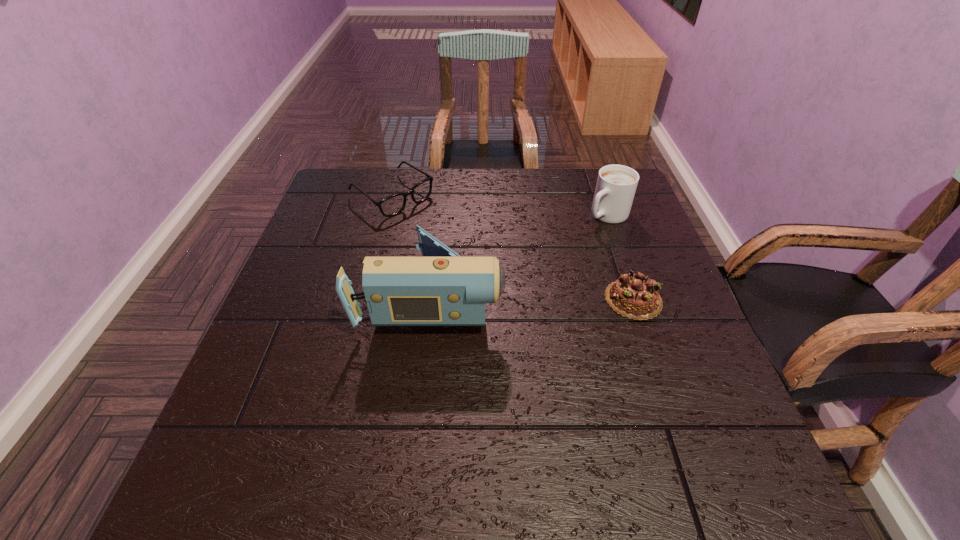
At what (x,y) coordinates should I click in order to perform the action: click on free spot between the cappuccino and the chocolate cake. Please return your answer as a coordinate pair (x, y). This screenshot has width=960, height=540. Looking at the image, I should click on (620, 257).

You are a GUI agent. You are given a task and a screenshot of the screen. Output one action in this format:
    pyautogui.click(x=<x>, y=<y>)
    Task: Click on the free space between the chocolate cake and the camcorder
    This screenshot has width=960, height=540.
    Given the screenshot: What is the action you would take?
    pyautogui.click(x=533, y=298)

Identify the location of vacant space that's between the spectacles and the cappuccino. The image size is (960, 540). (499, 205).

This screenshot has height=540, width=960. In order to click on free spot between the chocolate cake and the tallest object in this screenshot , I will do `click(533, 298)`.

Identify the location of vacant area that lies between the chocolate cake and the tallest object. Image resolution: width=960 pixels, height=540 pixels. (533, 298).

Locate an element on the screen. The image size is (960, 540). the second closest object to the second tallest object is located at coordinates (441, 288).

You are a GUI agent. You are given a task and a screenshot of the screen. Output one action in this format:
    pyautogui.click(x=<x>, y=<y>)
    Task: Click on the object that is the third closest one to the spectacles
    
    Given the screenshot: What is the action you would take?
    pyautogui.click(x=635, y=296)

The width and height of the screenshot is (960, 540). Identify the location of free space that satisfies the following two spatial constraints: 1. on the back side of the cappuccino; 2. on the left side of the chocolate cake. (605, 215).

Where is `free region that satisfies the following two spatial constraints: 1. on the front side of the spectacles; 2. on the side of the tallest object with the flip-out screen`? free region that satisfies the following two spatial constraints: 1. on the front side of the spectacles; 2. on the side of the tallest object with the flip-out screen is located at coordinates 367,296.

Where is `vacant space that satisfies the following two spatial constraints: 1. on the front side of the tallest object; 2. on the side of the spectacles with the flip-out screen`? The height and width of the screenshot is (540, 960). vacant space that satisfies the following two spatial constraints: 1. on the front side of the tallest object; 2. on the side of the spectacles with the flip-out screen is located at coordinates (367, 296).